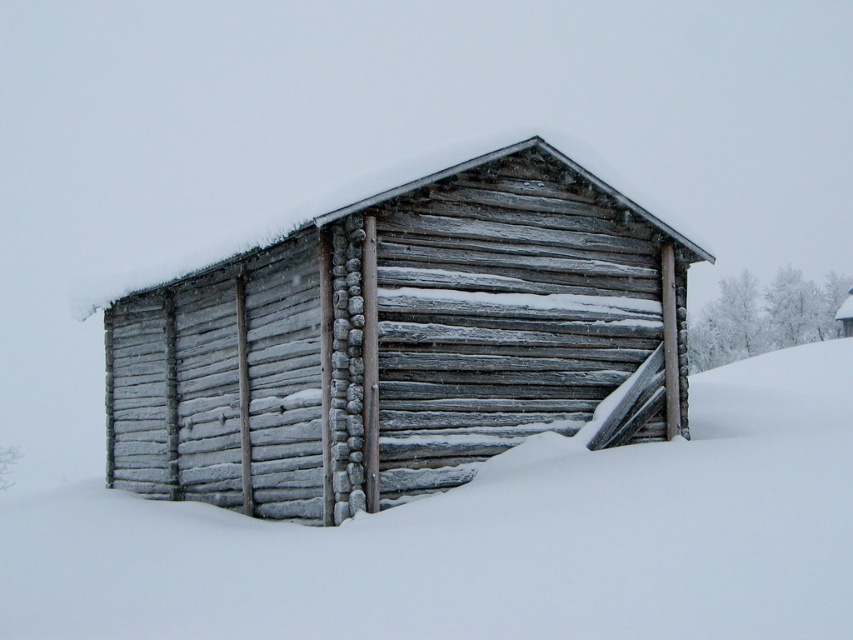
You are standing at the entrance of the rustic wooden shed and want to walk towards the point that is closer to you. Which point should you head towards, point (224, 458) or point (849, 385)?

Point (224, 458) is in front of point (849, 385), so you should head towards point (224, 458) since it is closer to you.

You are an architect designing a new winter retreat and want to ensure the building fits within the snowy landscape. Based on the image, which object has a smaller width between the gray wooden cabin at center and the white frosty snow at center?

The gray wooden cabin at center has a lesser width compared to the white frosty snow at center, so the gray wooden cabin at center is narrower.